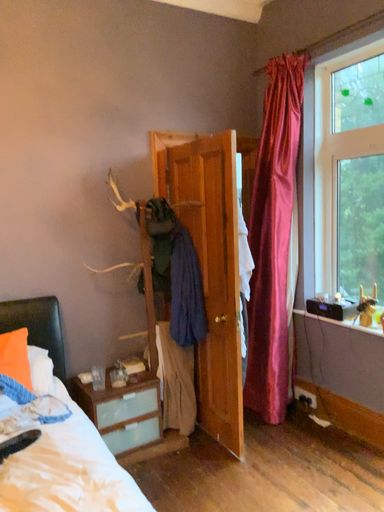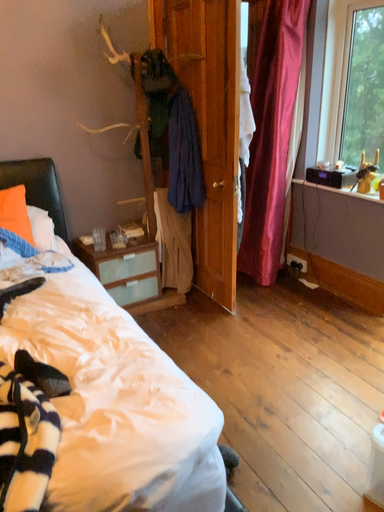
Question: Which way did the camera rotate in the video?

Choices:
 (A) rotated upward
 (B) rotated downward

Answer: (B)